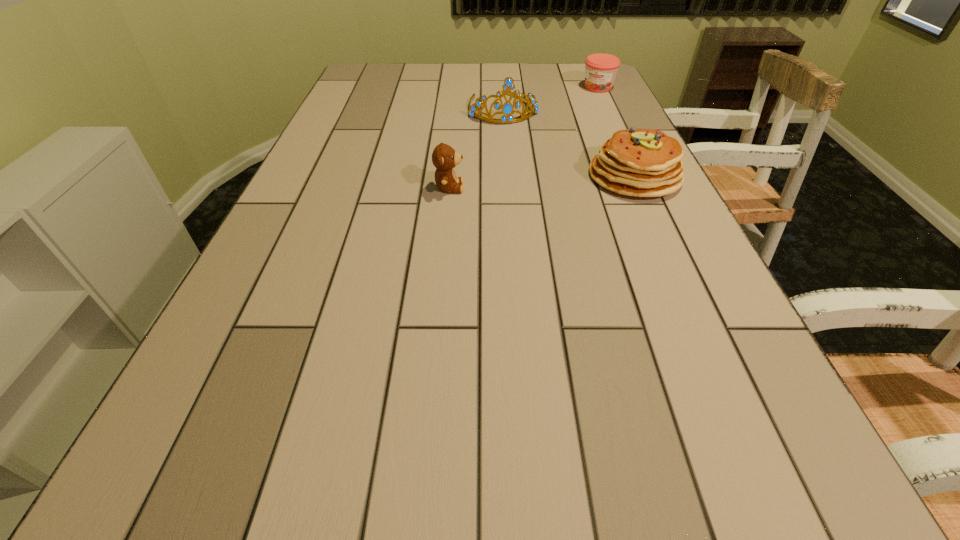
At what (x,y) coordinates should I click in order to perform the action: click on teddy bear. Please return your answer as a coordinate pair (x, y). The height and width of the screenshot is (540, 960). Looking at the image, I should click on (444, 158).

At what (x,y) coordinates should I click in order to perform the action: click on pancake. Please return your answer as a coordinate pair (x, y). The image size is (960, 540). Looking at the image, I should click on (636, 162).

Locate an element on the screen. The width and height of the screenshot is (960, 540). jam is located at coordinates (600, 69).

Where is `the tallest object`? The width and height of the screenshot is (960, 540). the tallest object is located at coordinates (507, 108).

This screenshot has width=960, height=540. I want to click on the second object from left to right, so click(x=507, y=108).

At what (x,y) coordinates should I click in order to perform the action: click on vacant region located 0.150m on the face of the leftmost object. Please return your answer as a coordinate pair (x, y). This screenshot has width=960, height=540. Looking at the image, I should click on (526, 188).

In order to click on free spot located on the back of the pancake in this screenshot , I will do `click(601, 102)`.

Locate an element on the screen. This screenshot has width=960, height=540. free space located on the front label of the shortest object is located at coordinates (551, 146).

Where is `free space located 0.150m on the front label of the shortest object`? The image size is (960, 540). free space located 0.150m on the front label of the shortest object is located at coordinates (579, 111).

Identify the location of free space located 0.370m on the front label of the shortest object. This screenshot has width=960, height=540. (554, 143).